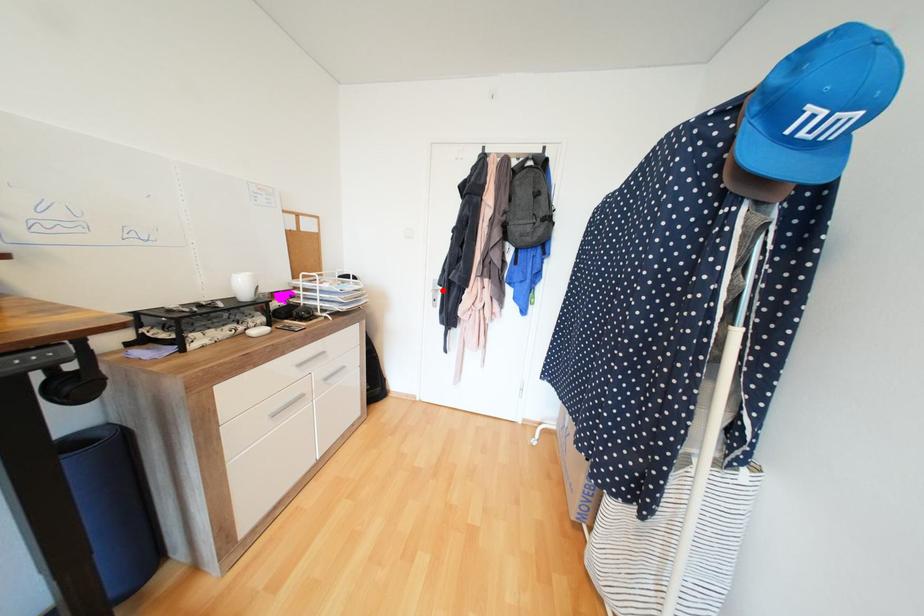
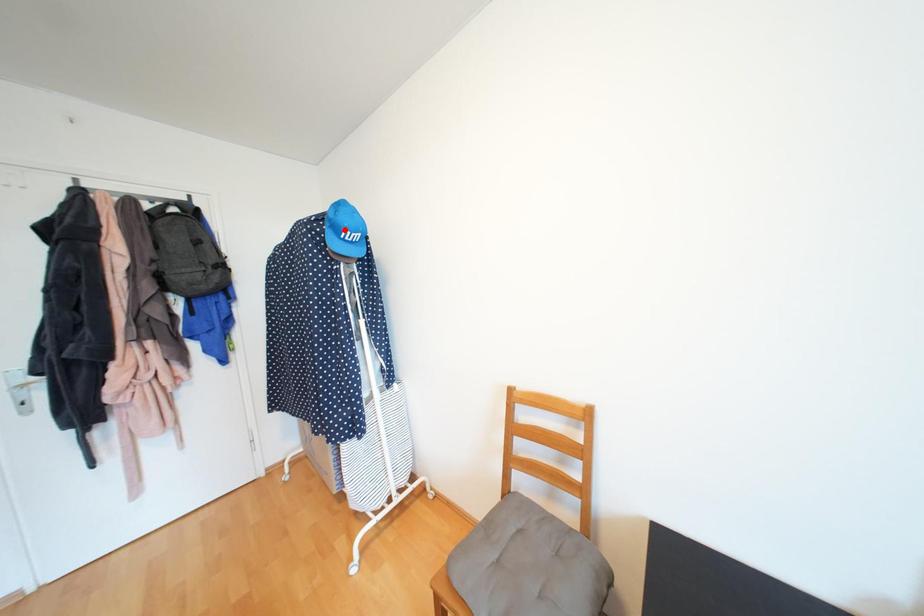
I am providing you with two images of the same scene from different viewpoints. A red point is marked on the first image and another point is marked on the second image. Is the red point in image1 aligned with the point shown in image2?

No